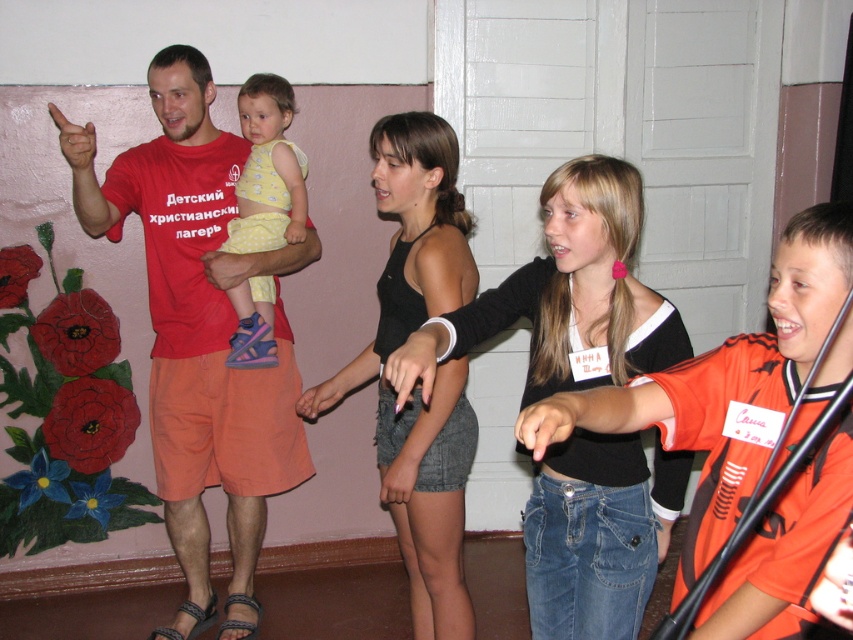
Which is below, matte red t-shirt at center or black cotton tank top at center?

black cotton tank top at center

Who is higher up, matte red t-shirt at center or black cotton tank top at center?

Positioned higher is matte red t-shirt at center.

Is point (149, 388) closer to viewer compared to point (448, 376)?

No, (149, 388) is further to viewer.

Image resolution: width=853 pixels, height=640 pixels. In order to click on matte red t-shirt at center in this screenshot , I will do point(199,332).

In the scene shown: Is black cotton tank top at center bigger than yellow dotted fabric at center?

Yes.

Can you confirm if black cotton tank top at center is wider than yellow dotted fabric at center?

Indeed, black cotton tank top at center has a greater width compared to yellow dotted fabric at center.

Does point (415, 316) come behind point (276, 218)?

No.

This screenshot has height=640, width=853. Identify the location of black cotton tank top at center. (409, 243).

Measure the distance from matte red t-shirt at center to yellow dotted fabric at center.

They are 22.92 centimeters apart.

Between matte red t-shirt at center and yellow dotted fabric at center, which one has less height?

Standing shorter between the two is yellow dotted fabric at center.

What are the coordinates of `matte red t-shirt at center` in the screenshot? It's located at (199, 332).

The image size is (853, 640). Find the location of `matte red t-shirt at center`. matte red t-shirt at center is located at coordinates (199, 332).